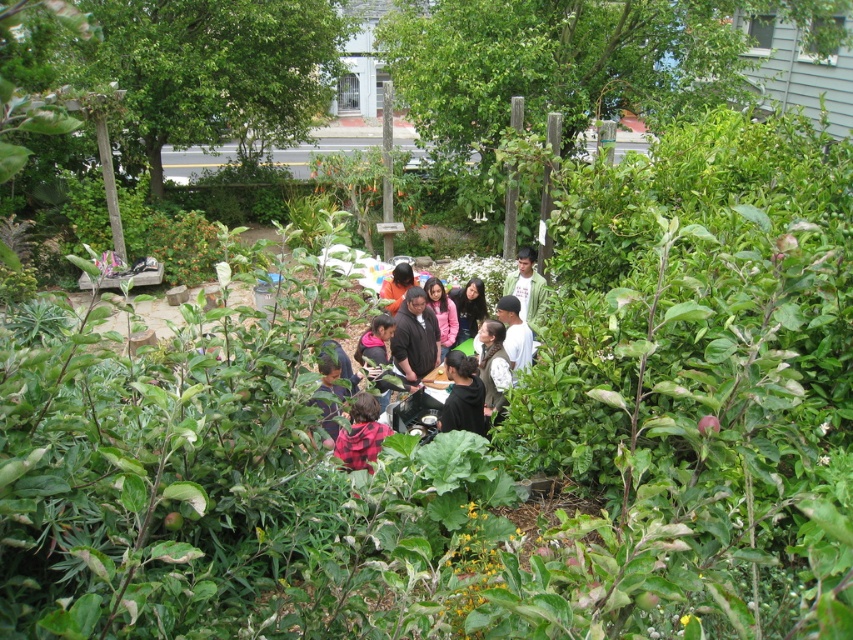
Question: Is plaid fabric shirt at center below white matte shirt at center?

Choices:
 (A) no
 (B) yes

Answer: (B)

Question: Which point is farther from the camera taking this photo?

Choices:
 (A) (360, 461)
 (B) (351, 266)
 (C) (532, 276)

Answer: (B)

Question: Does dark brown jacket at center have a larger size compared to plaid fabric shirt at center?

Choices:
 (A) yes
 (B) no

Answer: (B)

Question: Which object is the farthest from the green matte jacket at center?

Choices:
 (A) dark brown jacket at center
 (B) plaid fabric shirt at center
 (C) white matte shirt at center

Answer: (A)

Question: Which of the following is the farthest from the observer?

Choices:
 (A) green matte jacket at center
 (B) dark brown jacket at center

Answer: (B)

Question: Does dark brown jacket at center have a smaller size compared to plaid fabric shirt at center?

Choices:
 (A) no
 (B) yes

Answer: (B)